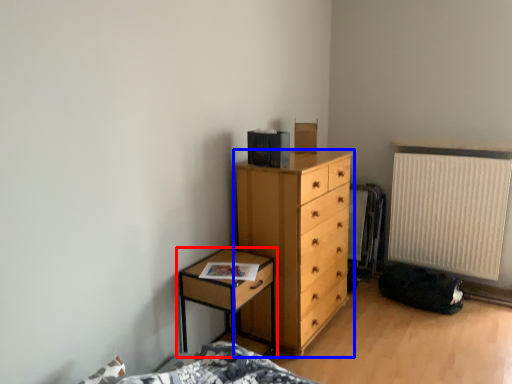
Question: Which object is closer to the camera taking this photo, nightstand (highlighted by a red box) or chest of drawers (highlighted by a blue box)?

Choices:
 (A) nightstand
 (B) chest of drawers

Answer: (A)